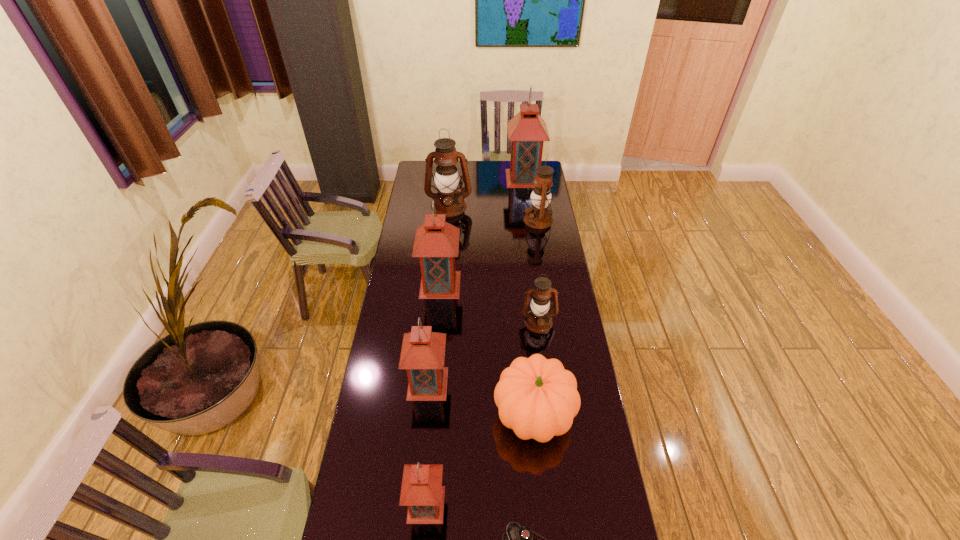
Where is `the tallest object`? The height and width of the screenshot is (540, 960). the tallest object is located at coordinates (527, 131).

At what (x,y) coordinates should I click in order to perform the action: click on the tallest lantern. Please return your answer as a coordinate pair (x, y). Image resolution: width=960 pixels, height=540 pixels. Looking at the image, I should click on [527, 131].

You are a GUI agent. You are given a task and a screenshot of the screen. Output one action in this format:
    pyautogui.click(x=<x>, y=<y>)
    Task: Click on the leftmost brown lantern
    Image resolution: width=960 pixels, height=540 pixels.
    Given the screenshot: What is the action you would take?
    pyautogui.click(x=449, y=201)

Locate an element on the screen. the second biggest pink lantern is located at coordinates (436, 243).

Find the location of a particular element. The height and width of the screenshot is (540, 960). the fourth farthest object is located at coordinates tap(436, 243).

This screenshot has width=960, height=540. Identify the location of the sixth farthest lantern. pyautogui.click(x=423, y=352).

Find the location of a particular element. This screenshot has width=960, height=540. the second smallest pink lantern is located at coordinates (423, 352).

Where is `the second biggest brown lantern`? Image resolution: width=960 pixels, height=540 pixels. the second biggest brown lantern is located at coordinates (538, 216).

This screenshot has width=960, height=540. What are the coordinates of `the fifth farthest object` in the screenshot? It's located at pos(538,319).

The image size is (960, 540). I want to click on the smallest brown lantern, so click(x=538, y=319).